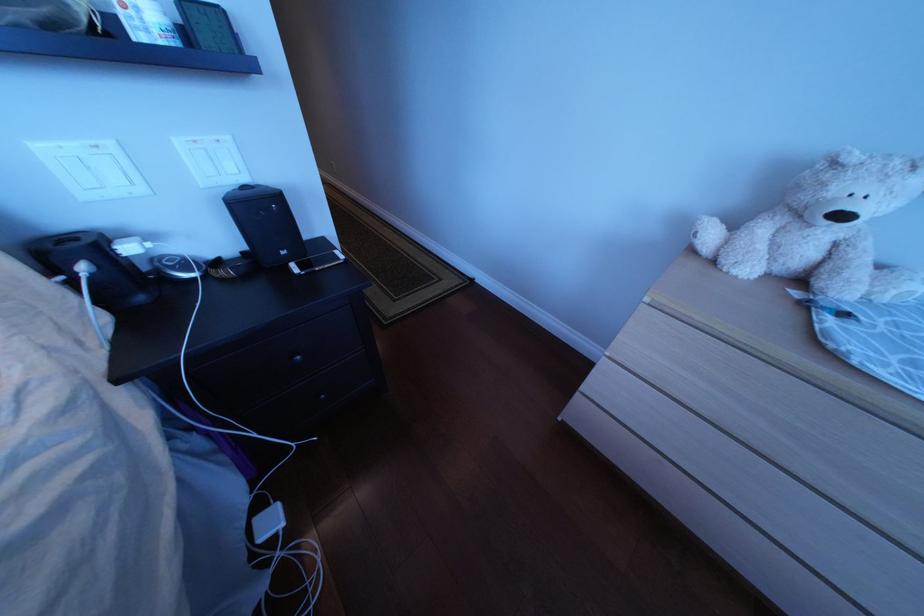
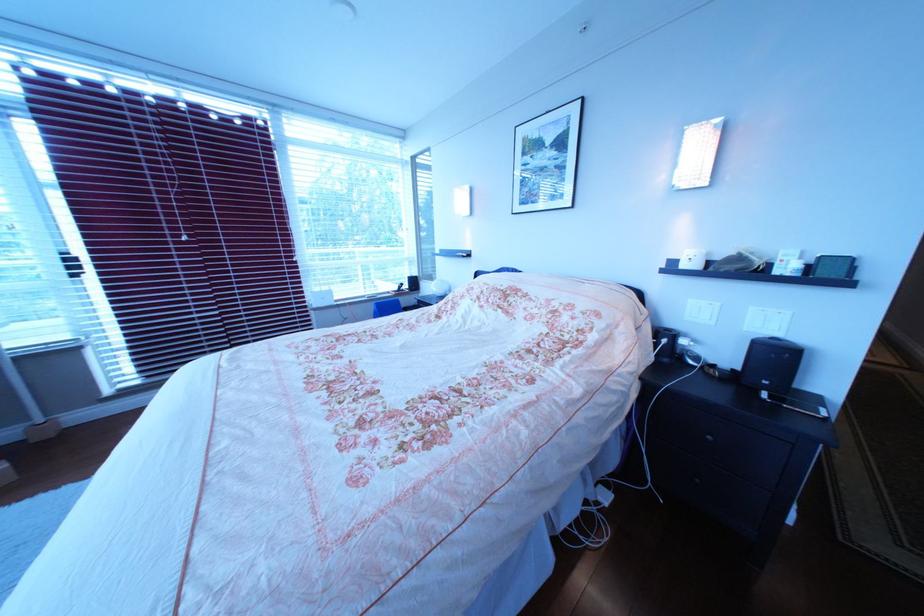
Locate, in the second image, the point that corresponds to the point at 189,142 in the first image.

(767, 310)